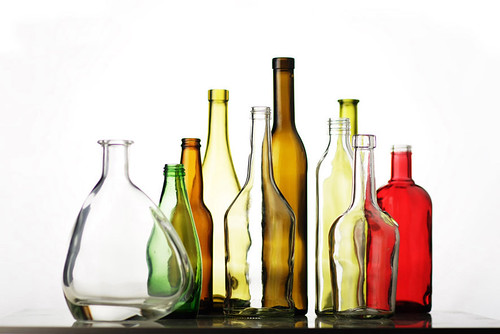
This screenshot has height=334, width=500. Find the location of `empty colored bottles`. empty colored bottles is located at coordinates (134, 240), (171, 207), (186, 185), (212, 176), (261, 223), (352, 122), (366, 254), (325, 180), (418, 220).